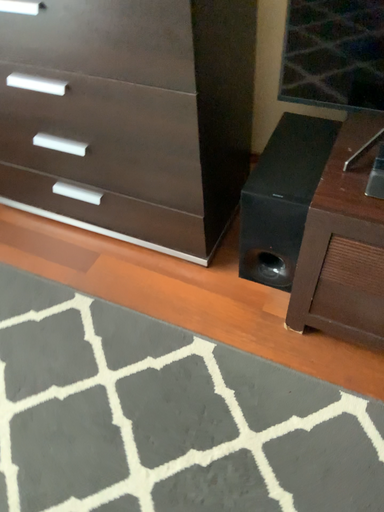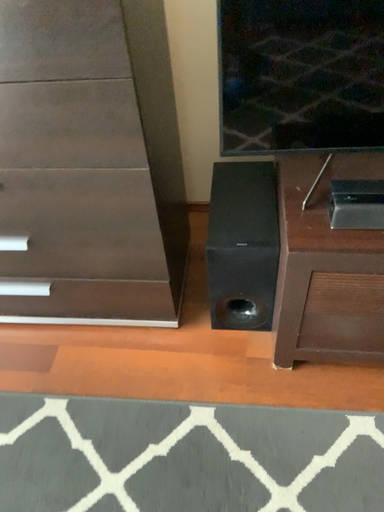
Question: Which way did the camera rotate in the video?

Choices:
 (A) rotated downward
 (B) rotated upward

Answer: (B)